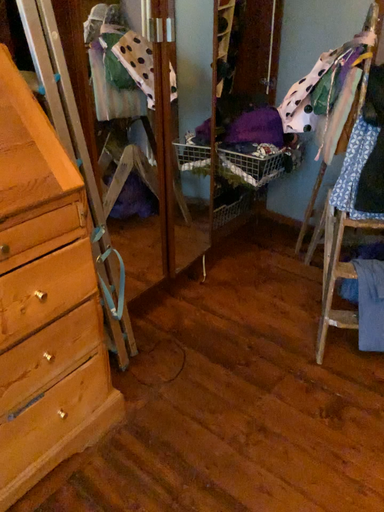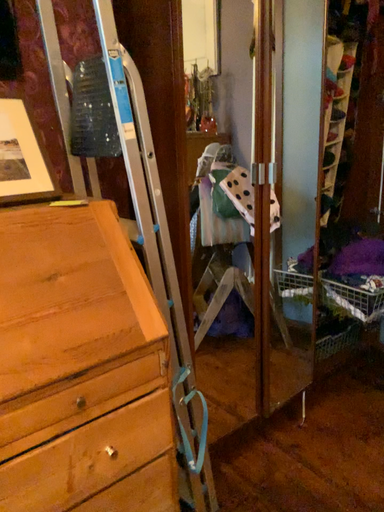
Question: Which way did the camera rotate in the video?

Choices:
 (A) rotated left
 (B) rotated right

Answer: (A)